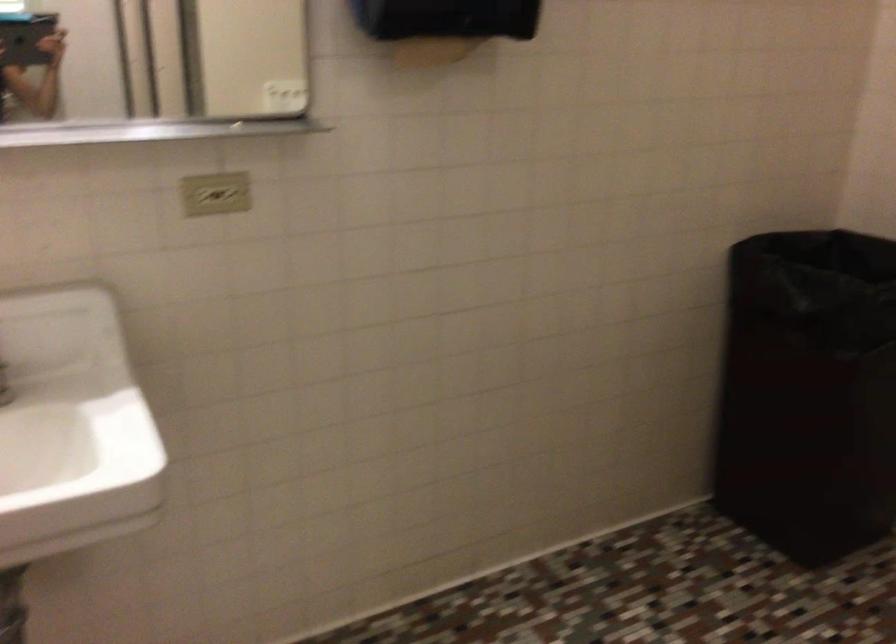
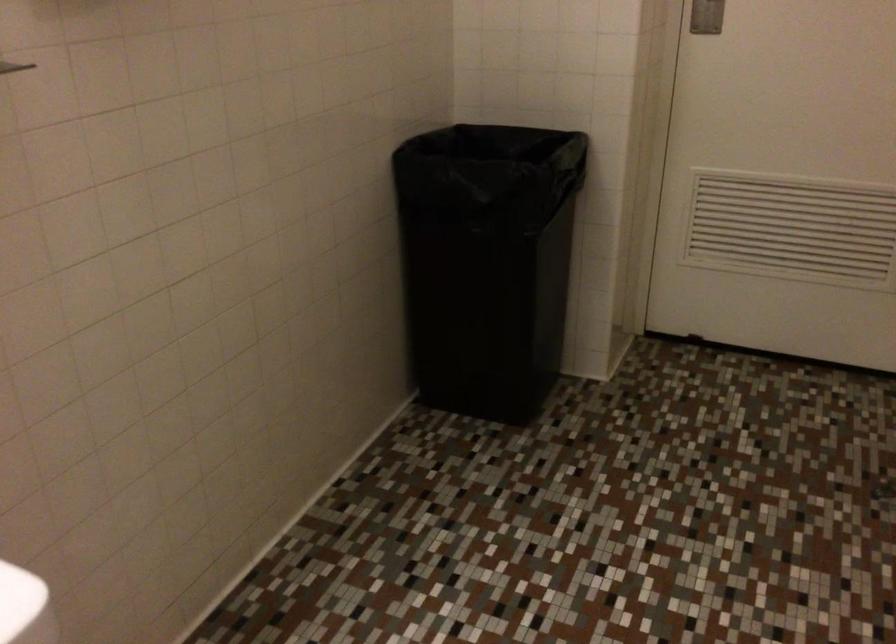
Question: Based on the continuous images, in which direction is the camera rotating? Reply with the corresponding letter.

Choices:
 (A) Left
 (B) Right
 (C) Up
 (D) Down

Answer: (B)